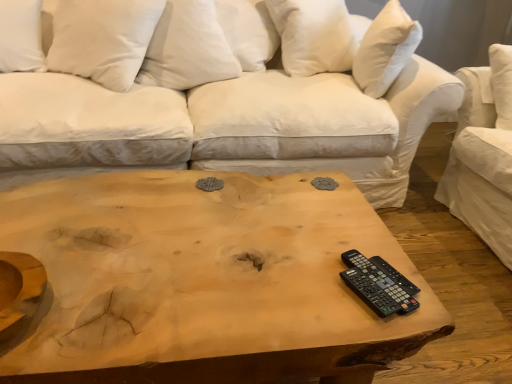
Describe the element at coordinates (379, 284) in the screenshot. I see `black plastic remote at lower right` at that location.

Where is `white cotton studio couch at center`? The width and height of the screenshot is (512, 384). white cotton studio couch at center is located at coordinates pos(229,91).

Measure the distance between point (16,0) and camera.

Point (16,0) and camera are 1.96 meters apart from each other.

This screenshot has height=384, width=512. I want to click on natural wood coffee table at center, so click(205, 281).

Where is `white soft pillow at upper right, the 4th pillow in the left-to-right sequence`? white soft pillow at upper right, the 4th pillow in the left-to-right sequence is located at coordinates (385, 49).

Considering the points (3, 212) and (23, 27), which point is behind, point (3, 212) or point (23, 27)?

The point (23, 27) is farther.

Is natural wood coffee table at center bigger than white soft pillow at upper left, the 1th pillow positioned from the left?

Correct, natural wood coffee table at center is larger in size than white soft pillow at upper left, the 1th pillow positioned from the left.

Considering the sizes of natural wood coffee table at center and white soft pillow at upper left, the 1th pillow positioned from the left, in the image, is natural wood coffee table at center wider or thinner than white soft pillow at upper left, the 1th pillow positioned from the left,?

natural wood coffee table at center is wider than white soft pillow at upper left, the 1th pillow positioned from the left.

What's the angular difference between natural wood coffee table at center and white soft pillow at upper left, the 1th pillow positioned from the left,'s facing directions?

The angle between the facing direction of natural wood coffee table at center and the facing direction of white soft pillow at upper left, the 1th pillow positioned from the left, is 21.3 degrees.

From the image's perspective, is white soft pillow at upper left, arranged as the fourth pillow when viewed from the right, located above or below white cotton studio couch at center?

Based on their image positions, white soft pillow at upper left, arranged as the fourth pillow when viewed from the right, is located above white cotton studio couch at center.

In the scene shown: Would you say white soft pillow at upper left, arranged as the fourth pillow when viewed from the right, is inside or outside white cotton studio couch at center?

white soft pillow at upper left, arranged as the fourth pillow when viewed from the right, is spatially positioned inside white cotton studio couch at center.

This screenshot has width=512, height=384. I want to click on studio couch that is under the white soft pillow at upper left, arranged as the fourth pillow when viewed from the right (from a real-world perspective), so click(x=229, y=91).

Could you tell me if natural wood coffee table at center is turned towards black plastic remote at lower right?

No, natural wood coffee table at center is not aimed at black plastic remote at lower right.

In the image, is natural wood coffee table at center on the left side or the right side of black plastic remote at lower right?

Based on their positions, natural wood coffee table at center is located to the left of black plastic remote at lower right.

Is natural wood coffee table at center not within black plastic remote at lower right?

Yes, natural wood coffee table at center is outside of black plastic remote at lower right.

From the picture: Between white soft pillow at upper left, the 1th pillow positioned from the left, and white soft pillow at upper right, the 4th pillow in the left-to-right sequence, which one appears on the left side from the viewer's perspective?

From the viewer's perspective, white soft pillow at upper left, the 1th pillow positioned from the left, appears more on the left side.

Is white soft pillow at upper left, arranged as the fourth pillow when viewed from the right, positioned behind white soft pillow at upper right, which appears as the first pillow when viewed from the right?

No, it is in front of white soft pillow at upper right, which appears as the first pillow when viewed from the right.

Based on the photo, can we say white soft pillow at upper left, the 1th pillow positioned from the left, lies outside white soft pillow at upper right, which appears as the first pillow when viewed from the right?

Yes, white soft pillow at upper left, the 1th pillow positioned from the left, is located beyond the bounds of white soft pillow at upper right, which appears as the first pillow when viewed from the right.

Does black plastic remote at lower right touch white soft pillow at upper right, which appears as the first pillow when viewed from the right?

black plastic remote at lower right and white soft pillow at upper right, which appears as the first pillow when viewed from the right, are not in contact.

Is point (405, 292) positioned after point (370, 74)?

No, (405, 292) is in front of (370, 74).

Is black plastic remote at lower right spatially inside white soft pillow at upper right, the 4th pillow in the left-to-right sequence, or outside of it?

The correct answer is: outside.

Does black plastic remote at lower right lie in front of white soft pillow at upper right, the 4th pillow in the left-to-right sequence?

Yes, black plastic remote at lower right is in front of white soft pillow at upper right, the 4th pillow in the left-to-right sequence.

From the image's perspective, does white soft pillow at upper right, the 4th pillow in the left-to-right sequence, appear lower than white cotton studio couch at center?

Incorrect, from the image's perspective, white soft pillow at upper right, the 4th pillow in the left-to-right sequence, is higher than white cotton studio couch at center.

In the image, is white soft pillow at upper right, the 4th pillow in the left-to-right sequence, on the left side or the right side of white cotton studio couch at center?

From the image, it's evident that white soft pillow at upper right, the 4th pillow in the left-to-right sequence, is to the right of white cotton studio couch at center.

How distant is white soft pillow at upper right, the 4th pillow in the left-to-right sequence, from white cotton studio couch at center?

white soft pillow at upper right, the 4th pillow in the left-to-right sequence, and white cotton studio couch at center are 18.86 inches apart from each other.

Is white soft pillow at upper right, the 4th pillow in the left-to-right sequence, directly adjacent to white cotton studio couch at center?

No, white soft pillow at upper right, the 4th pillow in the left-to-right sequence, is not next to white cotton studio couch at center.

How far apart are black plastic remote at lower right and white soft pillow at upper left, the third pillow in the right-to-left sequence?

black plastic remote at lower right and white soft pillow at upper left, the third pillow in the right-to-left sequence, are 5.05 feet apart from each other.

Is black plastic remote at lower right positioned far away from white soft pillow at upper left, positioned as the 2th pillow in left-to-right order?

black plastic remote at lower right is far away from white soft pillow at upper left, positioned as the 2th pillow in left-to-right order.

Is point (377, 260) closer to camera compared to point (55, 64)?

Yes, it is.

Image resolution: width=512 pixels, height=384 pixels. What are the coordinates of `the 3rd pillow located above the black plastic remote at lower right (from a real-world perspective)` in the screenshot? It's located at (103, 39).

What are the coordinates of `coffee table in front of the white soft pillow at upper left, arranged as the fourth pillow when viewed from the right` in the screenshot? It's located at (205, 281).

Locate an element on the screen. This screenshot has height=384, width=512. studio couch below the white soft pillow at upper left, arranged as the fourth pillow when viewed from the right (from a real-world perspective) is located at coordinates (229, 91).

Considering their positions, is white soft pillow at upper right, which appears as the first pillow when viewed from the right, positioned closer to black plastic remote at lower right than natural wood coffee table at center?

natural wood coffee table at center is closer to black plastic remote at lower right.

Considering their positions, is natural wood coffee table at center positioned further to white cotton studio couch at center than white soft pillow at upper left, the 1th pillow positioned from the left?

white soft pillow at upper left, the 1th pillow positioned from the left.

Which object lies further to the anchor point black plastic remote at lower right, white cotton studio couch at center or natural wood coffee table at center?

white cotton studio couch at center is positioned further to the anchor black plastic remote at lower right.

From the image, which object appears to be nearer to white soft pillow at upper left, the third pillow in the right-to-left sequence, white cotton pillow at upper center, the third pillow from the left, or white soft pillow at upper left, the 1th pillow positioned from the left?

Based on the image, white cotton pillow at upper center, the third pillow from the left, appears to be nearer to white soft pillow at upper left, the third pillow in the right-to-left sequence.

Considering their positions, is white cotton studio couch at center positioned further to white soft pillow at upper right, the 4th pillow in the left-to-right sequence, than white cotton pillow at upper center, the third pillow from the left?

The object further to white soft pillow at upper right, the 4th pillow in the left-to-right sequence, is white cotton pillow at upper center, the third pillow from the left.

Looking at the image, which one is located further to white cotton studio couch at center, white soft pillow at upper left, arranged as the fourth pillow when viewed from the right, or white cotton pillow at upper center, marked as the second pillow in a right-to-left arrangement?

The object further to white cotton studio couch at center is white soft pillow at upper left, arranged as the fourth pillow when viewed from the right.

Which object lies nearer to the anchor point natural wood coffee table at center, white soft pillow at upper right, which appears as the first pillow when viewed from the right, or white soft pillow at upper left, positioned as the 2th pillow in left-to-right order?

white soft pillow at upper left, positioned as the 2th pillow in left-to-right order.

When comparing their distances from white soft pillow at upper left, the third pillow in the right-to-left sequence, does white cotton studio couch at center or black plastic remote at lower right seem further?

black plastic remote at lower right is further to white soft pillow at upper left, the third pillow in the right-to-left sequence.

Where is `studio couch situated between white soft pillow at upper left, the third pillow in the right-to-left sequence, and black plastic remote at lower right from left to right`? Image resolution: width=512 pixels, height=384 pixels. studio couch situated between white soft pillow at upper left, the third pillow in the right-to-left sequence, and black plastic remote at lower right from left to right is located at coordinates 229,91.

Identify the location of control between natural wood coffee table at center and white cotton pillow at upper center, marked as the second pillow in a right-to-left arrangement, along the z-axis. This screenshot has height=384, width=512. (379, 284).

At what (x,y) coordinates should I click in order to perform the action: click on coffee table situated between white soft pillow at upper left, positioned as the 2th pillow in left-to-right order, and white soft pillow at upper right, the 4th pillow in the left-to-right sequence, from left to right. Please return your answer as a coordinate pair (x, y). This screenshot has height=384, width=512. Looking at the image, I should click on (205, 281).

This screenshot has width=512, height=384. What are the coordinates of `control located between white soft pillow at upper left, positioned as the 2th pillow in left-to-right order, and white soft pillow at upper right, the 4th pillow in the left-to-right sequence, in the left-right direction` in the screenshot? It's located at (379, 284).